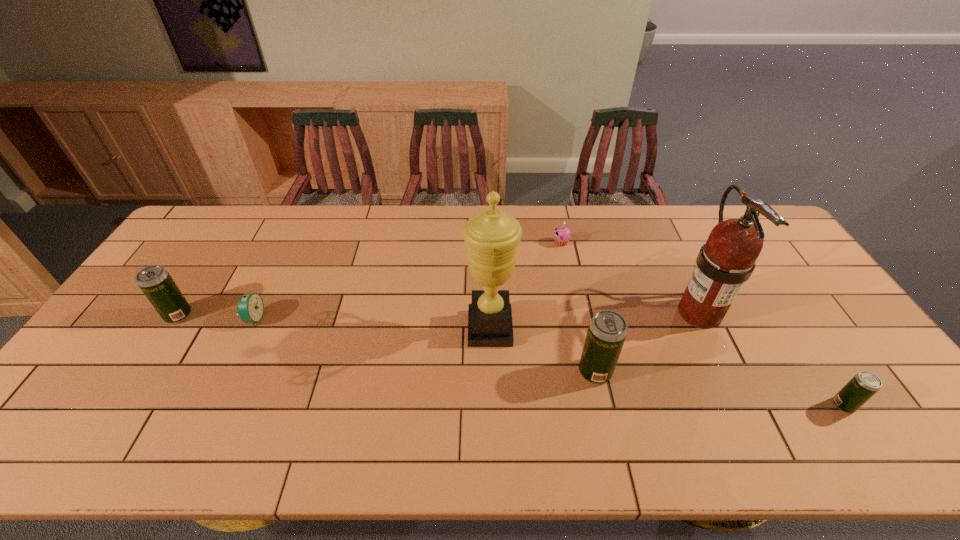
Locate an element on the screen. The image size is (960, 540). free spot between the fire extinguisher and the second beer can from right to left is located at coordinates (647, 342).

Identify the location of free area in between the second beer can from left to right and the second object from right to left. (647, 342).

The image size is (960, 540). I want to click on vacant area that lies between the sixth object from left to right and the second nearest beer can, so click(x=647, y=342).

I want to click on free space between the farthest object and the second beer can from left to right, so click(x=578, y=307).

Where is `free space that is in between the cupcake and the second nearest beer can`? Image resolution: width=960 pixels, height=540 pixels. free space that is in between the cupcake and the second nearest beer can is located at coordinates (578, 307).

The height and width of the screenshot is (540, 960). In order to click on free point between the second beer can from right to left and the leftmost object in this screenshot , I will do `click(387, 343)`.

Find the location of a particular element. Image resolution: width=960 pixels, height=540 pixels. vacant area between the sixth object from left to right and the fifth tallest object is located at coordinates (771, 359).

Locate an element on the screen. The width and height of the screenshot is (960, 540). vacant space that is in between the second object from left to right and the leftmost beer can is located at coordinates (216, 317).

You are a GUI agent. You are given a task and a screenshot of the screen. Output one action in this format:
    pyautogui.click(x=<x>, y=<y>)
    Task: Click on the vacant area that lies between the trophy cup and the alarm clock
    
    Given the screenshot: What is the action you would take?
    pyautogui.click(x=372, y=323)

The height and width of the screenshot is (540, 960). Find the location of `vacant space that's between the alarm clock and the nearest object`. vacant space that's between the alarm clock and the nearest object is located at coordinates (549, 362).